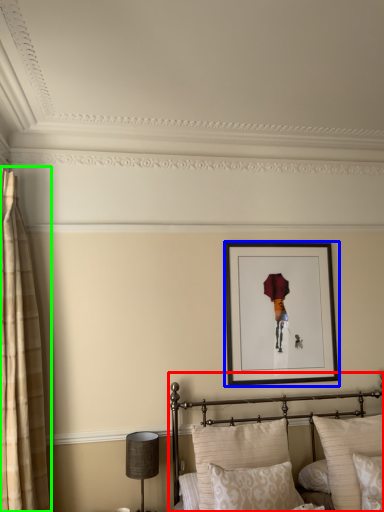
Question: Considering the real-world distances, which object is closest to bed (highlighted by a red box)? picture frame (highlighted by a blue box) or curtain (highlighted by a green box).

Choices:
 (A) picture frame
 (B) curtain

Answer: (A)